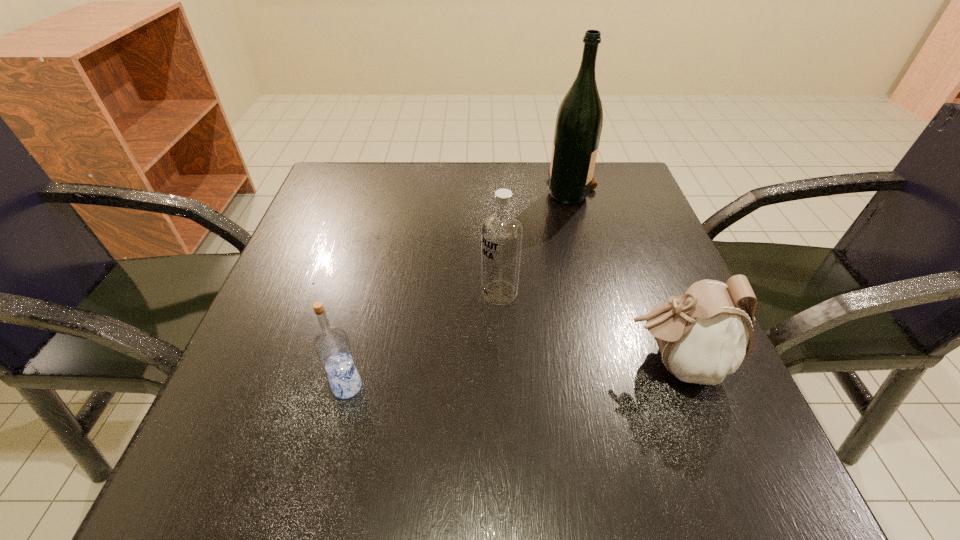
The image size is (960, 540). I want to click on vacant region at the far edge, so click(530, 205).

In the image, there is a desktop. Where is `vacant region at the near edge`? The image size is (960, 540). vacant region at the near edge is located at coordinates (555, 477).

At what (x,y) coordinates should I click in order to perform the action: click on vacant region at the left edge of the desktop. Please return your answer as a coordinate pair (x, y). The height and width of the screenshot is (540, 960). Looking at the image, I should click on (370, 221).

I want to click on vacant space at the right edge of the desktop, so click(672, 282).

Where is `vacant space at the far left corner`? This screenshot has width=960, height=540. vacant space at the far left corner is located at coordinates (355, 166).

Where is `blank space at the far right corner`? The width and height of the screenshot is (960, 540). blank space at the far right corner is located at coordinates (640, 215).

The height and width of the screenshot is (540, 960). Find the location of `free space between the leftmost object and the second farthest object`. free space between the leftmost object and the second farthest object is located at coordinates (423, 340).

This screenshot has width=960, height=540. I want to click on unoccupied area between the third nearest object and the tallest object, so click(536, 241).

Identify the location of free space between the third shortest object and the nearer vodka. (423, 340).

You are a GUI agent. You are given a task and a screenshot of the screen. Output one action in this format:
    pyautogui.click(x=<x>, y=<y>)
    Task: Click on the empty location between the pouch and the nearer vodka
    
    Given the screenshot: What is the action you would take?
    pyautogui.click(x=511, y=375)